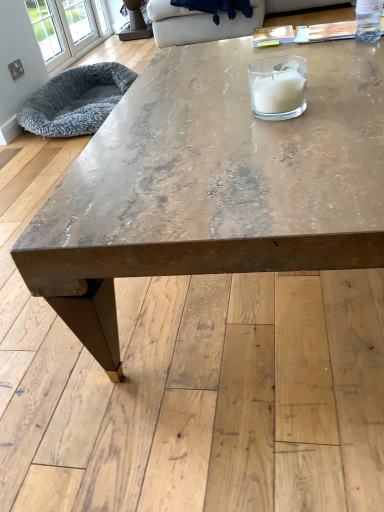
At what (x,y) coordinates should I click in order to perform the action: click on free point to the left of clear glass bottle at upper right. Please return your answer as a coordinate pair (x, y). The image size is (384, 512). Looking at the image, I should click on (326, 51).